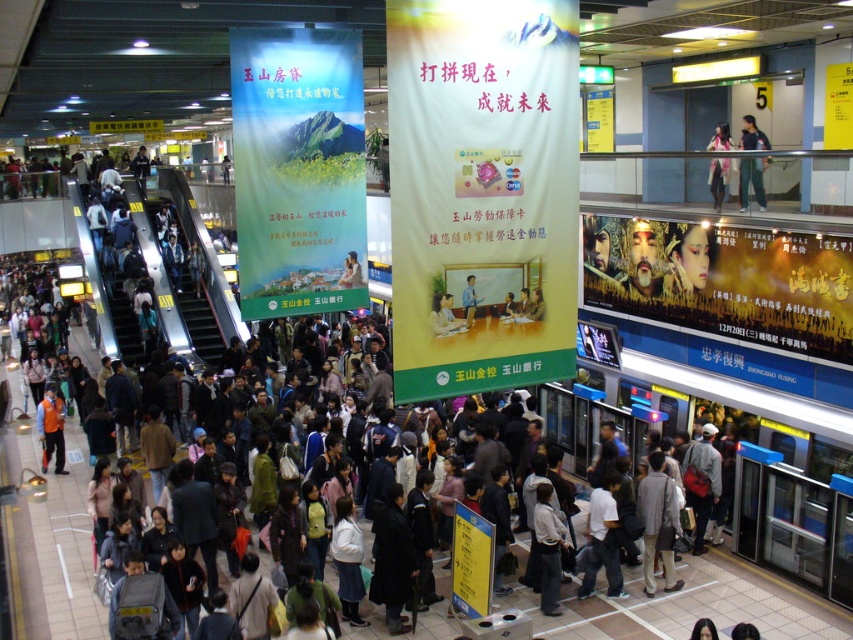
Question: Which of the following is the farthest from the observer?

Choices:
 (A) green matte banner at center
 (B) light beige fabric coat at center
 (C) white cotton shirt at center
 (D) pink fabric at upper center

Answer: (D)

Question: Does green matte banner at center come behind metallic silver escalator at left?

Choices:
 (A) no
 (B) yes

Answer: (A)

Question: Does metallic silver escalator at left appear on the right side of orange reflective vest at center?

Choices:
 (A) yes
 (B) no

Answer: (B)

Question: Is light beige fabric coat at center closer to camera compared to white cotton shirt at center?

Choices:
 (A) no
 (B) yes

Answer: (A)

Question: Which object is closer to the camera taking this photo?

Choices:
 (A) metallic silver escalator at left
 (B) light beige fabric coat at center
 (C) green fabric pants at upper right

Answer: (B)

Question: Which object is the farthest from the pink fabric at upper center?

Choices:
 (A) matte black poster at right
 (B) green matte poster at center
 (C) green fabric pants at upper right
 (D) green matte banner at center

Answer: (D)